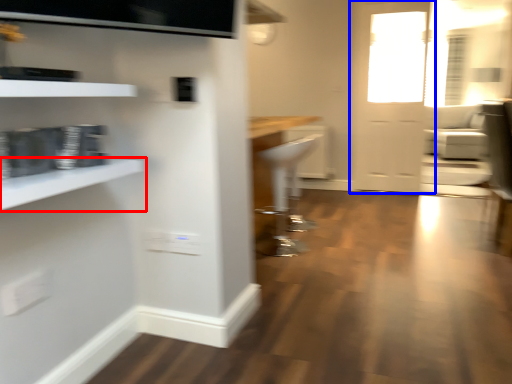
Question: Among these objects, which one is nearest to the camera, shelf (highlighted by a red box) or door (highlighted by a blue box)?

Choices:
 (A) shelf
 (B) door

Answer: (A)